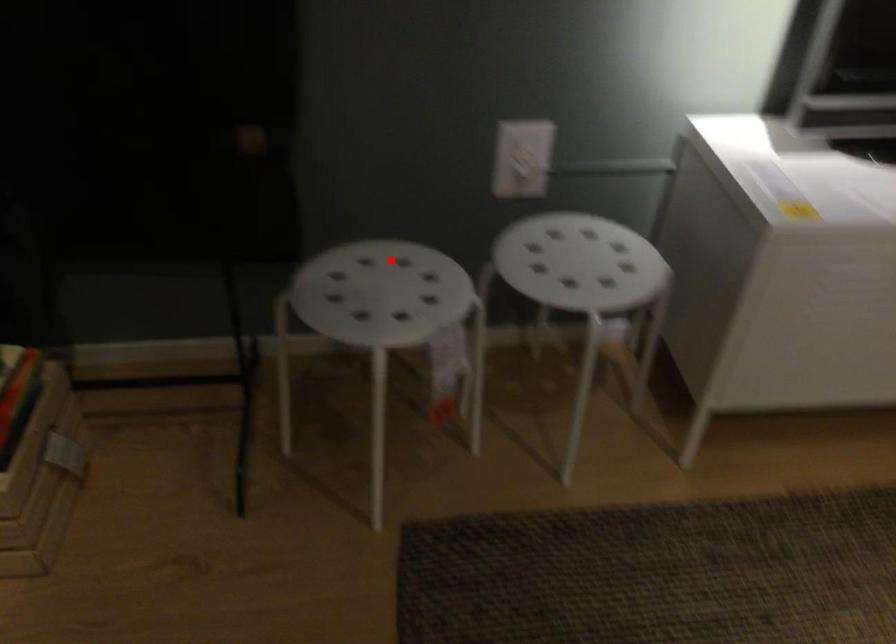
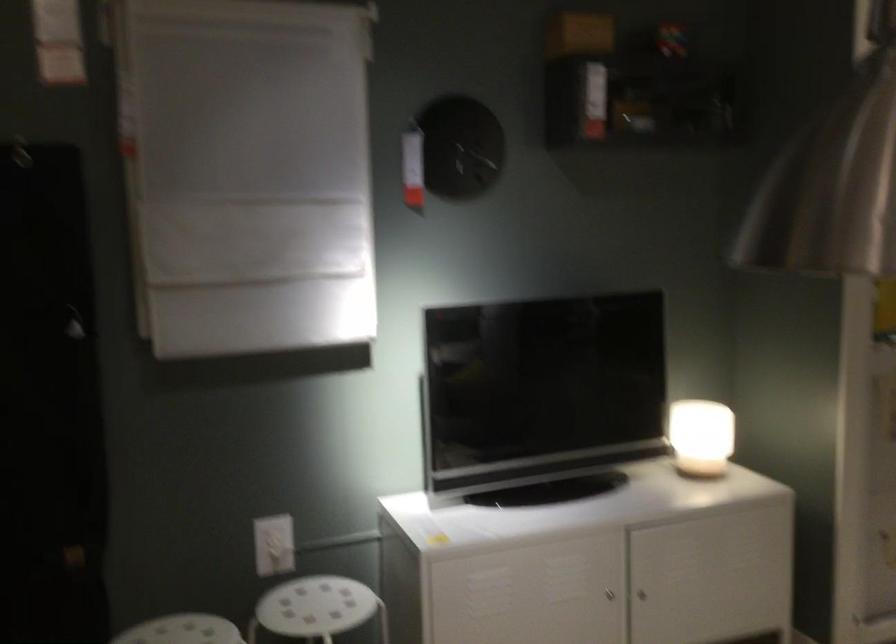
The point at the highlighted location is marked in the first image. Where is the corresponding point in the second image?

(182, 630)